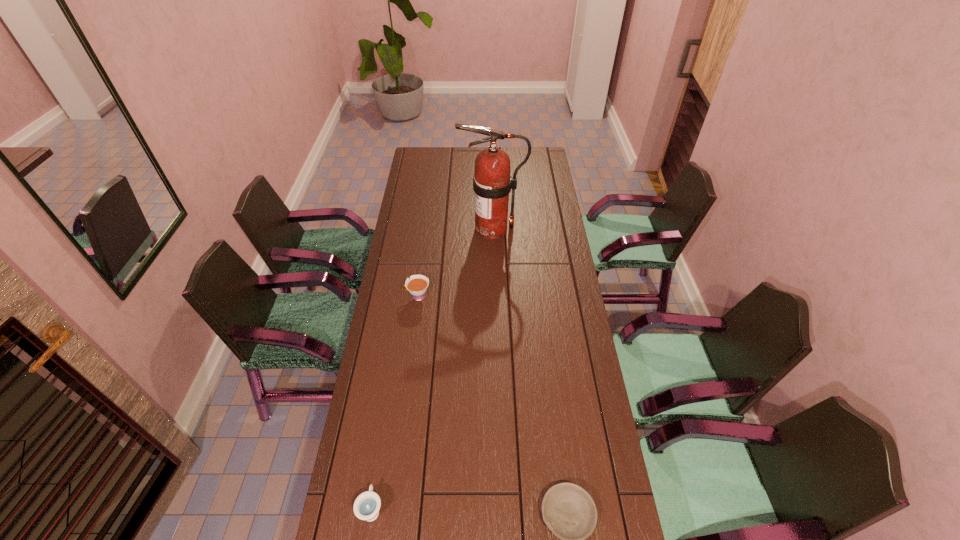
Where is `free space between the nearer teacup and the second farthest object`? Image resolution: width=960 pixels, height=540 pixels. free space between the nearer teacup and the second farthest object is located at coordinates (395, 403).

The image size is (960, 540). I want to click on object identified as the third closest to the taller teacup, so click(x=568, y=510).

You are a GUI agent. You are given a task and a screenshot of the screen. Output one action in this format:
    pyautogui.click(x=<x>, y=<y>)
    Task: Click on the object that can be found as the second closest to the shorter teacup
    
    Given the screenshot: What is the action you would take?
    pyautogui.click(x=417, y=285)